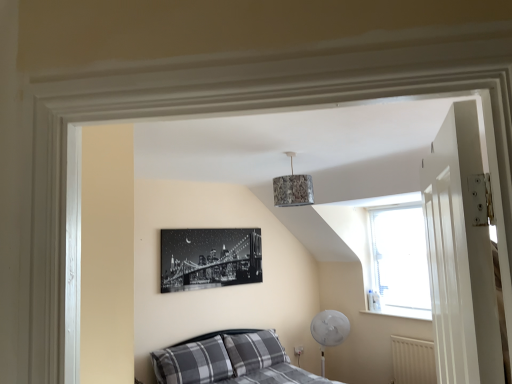
You are a GUI agent. You are given a task and a screenshot of the screen. Output one action in this format:
    pyautogui.click(x=<x>, y=<y>)
    Task: Click on the vacant area on top of black and white canvas print at center (from a real-world perspective)
    This screenshot has width=512, height=384.
    Given the screenshot: What is the action you would take?
    pyautogui.click(x=215, y=227)